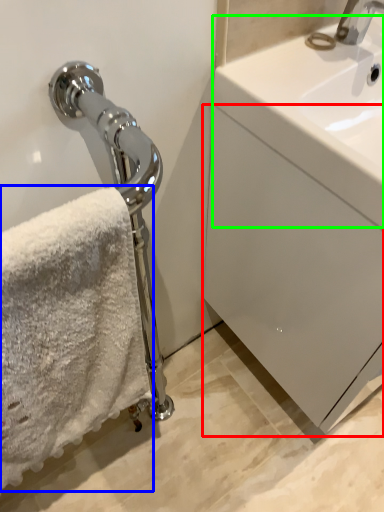
Question: Estimate the real-world distances between objects in this image. Which object is farther from drawer (highlighted by a red box), towel (highlighted by a blue box) or counter top (highlighted by a green box)?

Choices:
 (A) towel
 (B) counter top

Answer: (A)